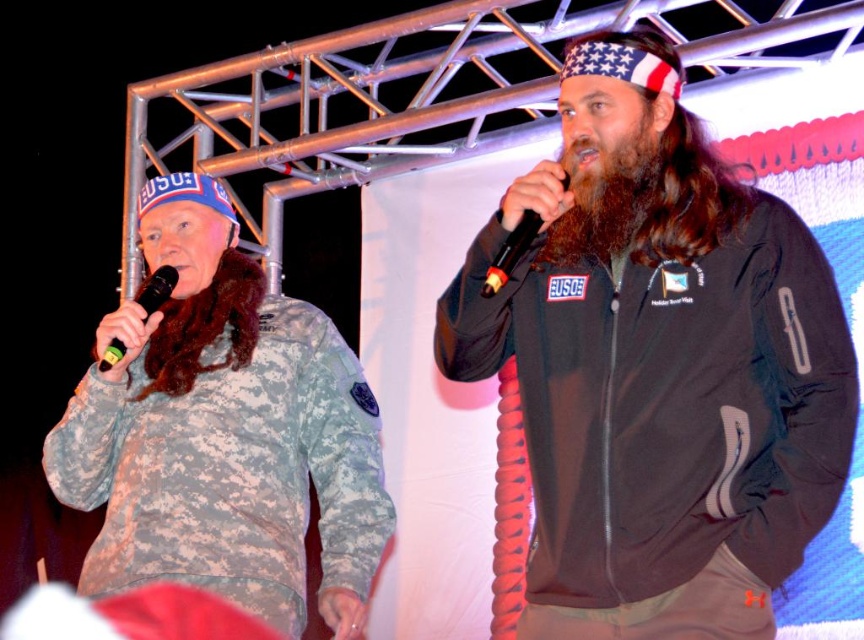
Question: Which object is farther from the camera taking this photo?

Choices:
 (A) black matte microphone at left
 (B) black matte jacket at center
 (C) camouflage sweatshirt at left
 (D) brownwoodybeard at right

Answer: (A)

Question: Is black plastic microphone at center below black matte microphone at left?

Choices:
 (A) no
 (B) yes

Answer: (A)

Question: Which object is farther from the camera taking this photo?

Choices:
 (A) black plastic microphone at center
 (B) black matte microphone at left
 (C) black matte jacket at center

Answer: (B)

Question: Estimate the real-world distances between objects in this image. Which object is closer to the black plastic microphone at center?

Choices:
 (A) black matte jacket at center
 (B) black matte microphone at left
 (C) brownwoodybeard at right

Answer: (C)

Question: Is black matte jacket at center below camouflage sweatshirt at left?

Choices:
 (A) no
 (B) yes

Answer: (A)

Question: Does brownwoodybeard at right lie behind black plastic microphone at center?

Choices:
 (A) yes
 (B) no

Answer: (A)